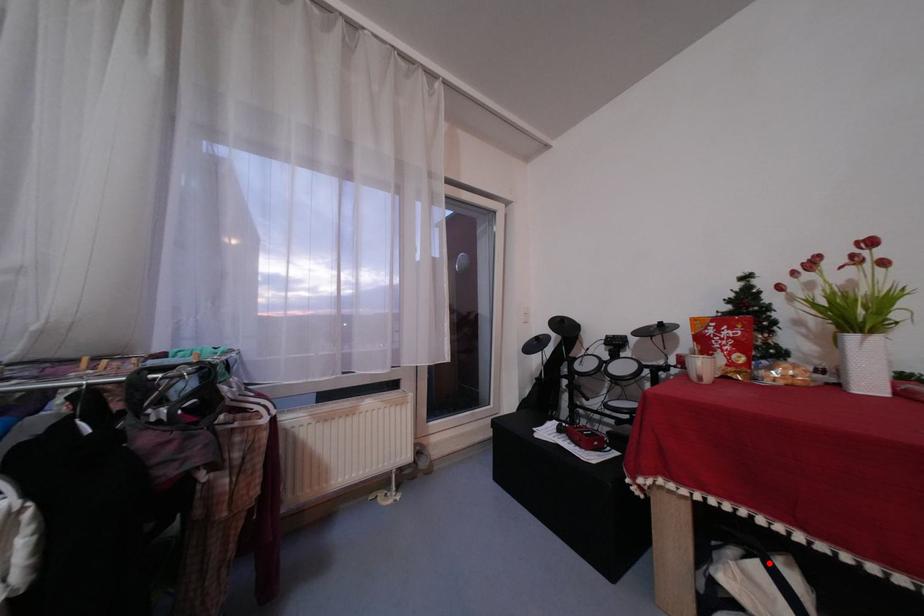
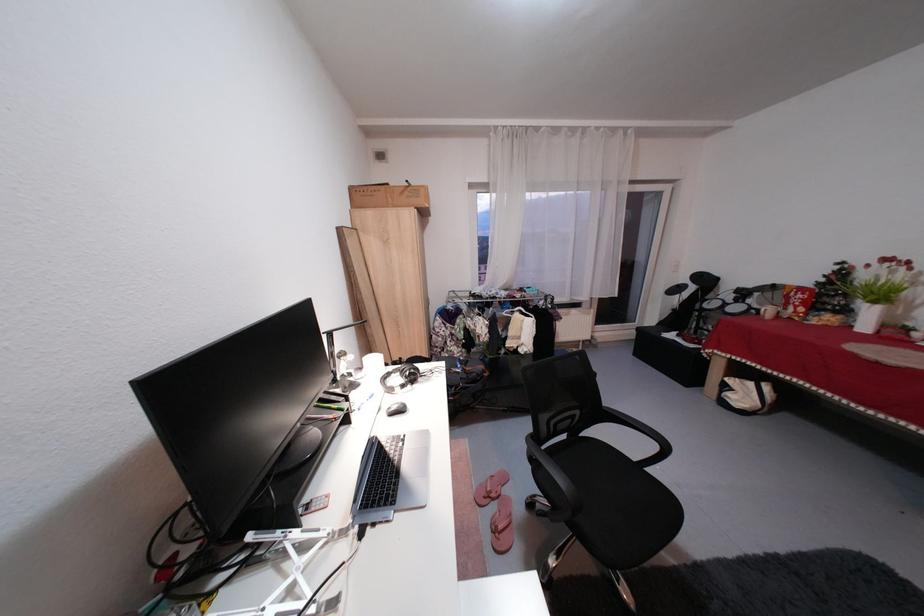
Question: I am providing you with two images of the same scene from different viewpoints. A red point is marked on the first image. Can you still see the location of the red point in image 2?

Choices:
 (A) Yes
 (B) No

Answer: (A)